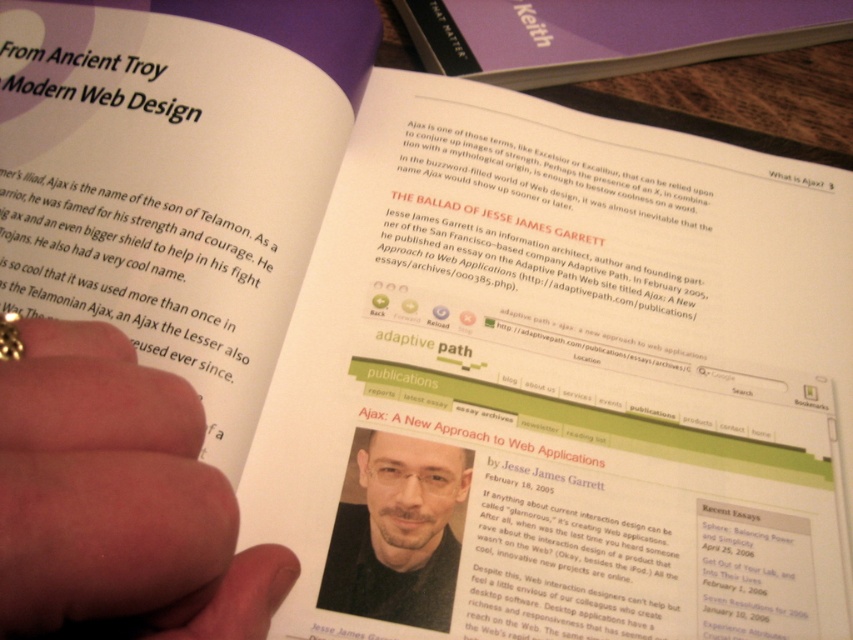
Question: Based on their relative distances, which object is farther from the smooth skin portrait at center?

Choices:
 (A) flesh-toned skin at center
 (B) purple matte book at upper center

Answer: (B)

Question: Which is farther from the flesh-toned skin at center?

Choices:
 (A) smooth skin portrait at center
 (B) purple matte book at upper center

Answer: (B)

Question: Which point is farther to the camera?

Choices:
 (A) smooth skin portrait at center
 (B) purple matte book at upper center
 (C) flesh-toned skin at center

Answer: (B)

Question: Can you confirm if flesh-toned skin at center is thinner than purple matte book at upper center?

Choices:
 (A) no
 (B) yes

Answer: (B)

Question: Does flesh-toned skin at center come in front of smooth skin portrait at center?

Choices:
 (A) no
 (B) yes

Answer: (B)

Question: Is the position of purple matte book at upper center more distant than that of smooth skin portrait at center?

Choices:
 (A) yes
 (B) no

Answer: (A)